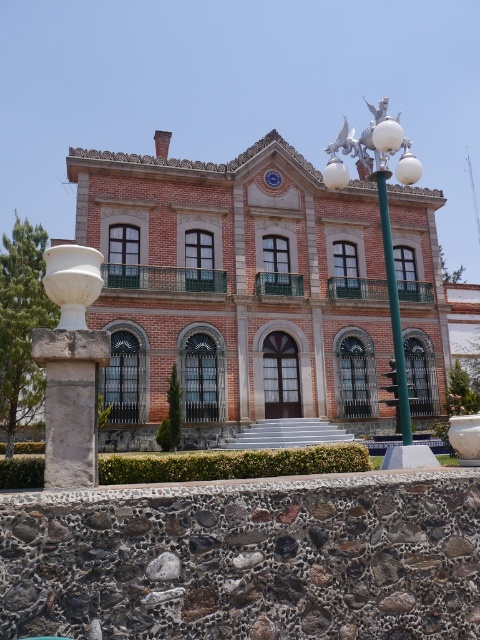
Who is higher up, white stone vase at left or green metallic pole at center?

green metallic pole at center is above.

How far apart are white stone vase at left and green metallic pole at center?

A distance of 12.67 meters exists between white stone vase at left and green metallic pole at center.

What do you see at coordinates (71, 365) in the screenshot? The height and width of the screenshot is (640, 480). I see `white stone vase at left` at bounding box center [71, 365].

At what (x,y) coordinates should I click in order to perform the action: click on white stone vase at left. Please return your answer as a coordinate pair (x, y). This screenshot has height=640, width=480. Looking at the image, I should click on coord(71,365).

Find the location of a particular element. white stone vase at left is located at coordinates (71, 365).

Does white stone vase at left have a lesser height compared to metallic silver lamp post at center?

Yes.

Which is in front, point (90, 262) or point (356, 156)?

Point (90, 262) is more forward.

Find the location of a particular element. The image size is (480, 640). white stone vase at left is located at coordinates (71, 365).

Is metallic silver lamp post at center shorter than green metallic pole at center?

No.

Which is behind, point (396, 321) or point (392, 259)?

The point (392, 259) is behind.

Between point (347, 173) and point (385, 188), which one is positioned behind?

Point (385, 188)

The image size is (480, 640). In order to click on metallic silver lamp post at center in this screenshot , I will do click(x=381, y=211).